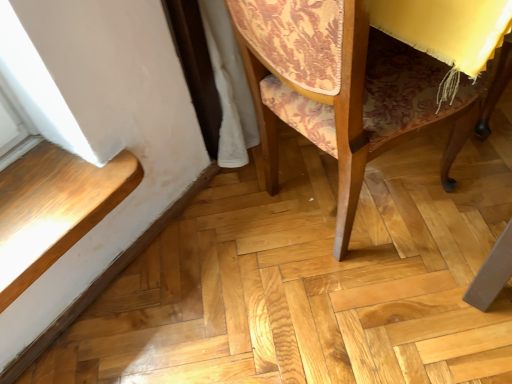
Identify the location of blank space above wooden floor at lower left (from a real-world perspective). (112, 257).